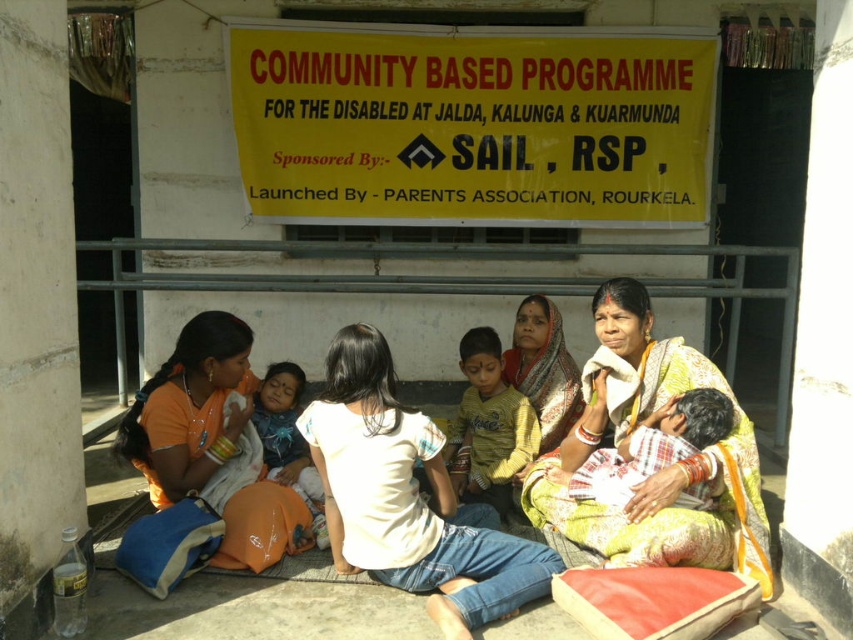
Please describe the location of the white cotton saree at center in the image using coordinates. The coordinates should be in the format of a point with two decimal places, like point X, Y.

Answer: The white cotton saree at center is located at point (408, 499).

You are a photographer standing at a distance. You want to capture a closeup shot of the yellow printed sari at center. Given that the camera you are using has a maximum zoom range of 10 feet, will you be able to focus on the sari without moving closer?

The yellow printed sari at center is 9.71 feet away from the camera. Since the camera can zoom up to 10 feet, you can focus on the sari without moving closer.

You are organizing a community event and need to ensure that the white cotton shirt at center and the printed fabric shawl at center can be displayed side by side on a narrow shelf. Based on their sizes, will they fit together on a shelf that is 1.2 meters wide?

The white cotton shirt at center is wider than the printed fabric shawl at center. However, without knowing their exact widths, it is impossible to determine if they will fit on a 1.2 meter shelf.